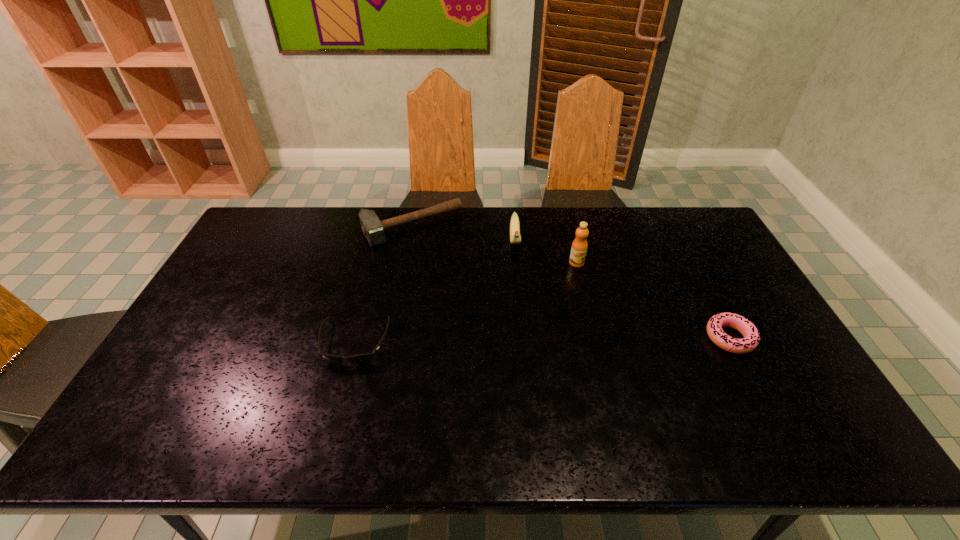
The height and width of the screenshot is (540, 960). Identify the location of sunglasses. (362, 358).

I want to click on the rightmost object, so click(x=750, y=332).

Image resolution: width=960 pixels, height=540 pixels. I want to click on the second tallest object, so coord(515,238).

I want to click on banana, so click(515, 238).

Identify the location of orange juice. (579, 247).

The width and height of the screenshot is (960, 540). In order to click on the fourth object from left to right in this screenshot , I will do `click(579, 247)`.

Locate an element on the screen. This screenshot has height=540, width=960. the third shortest object is located at coordinates (373, 229).

Find the location of `free point located on the front-facing side of the sunglasses`. free point located on the front-facing side of the sunglasses is located at coordinates (339, 402).

At what (x,y) coordinates should I click in order to perform the action: click on vacant area located on the back of the doughnut. Please return your answer as a coordinate pair (x, y). Looking at the image, I should click on (708, 295).

Where is `vacant space located at the stem of the second tallest object`? Image resolution: width=960 pixels, height=540 pixels. vacant space located at the stem of the second tallest object is located at coordinates (518, 307).